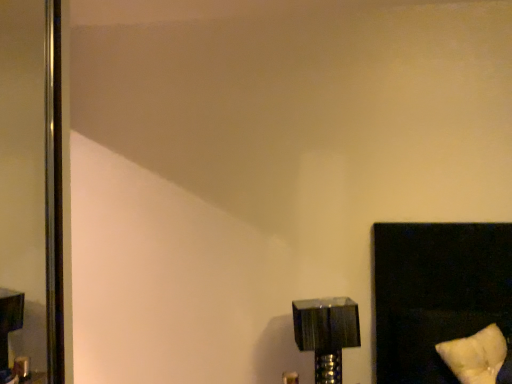
Image resolution: width=512 pixels, height=384 pixels. I want to click on white soft pillow at lower right, so point(475,355).

Which object is further away from the camera, polished metallic screen door at left or white soft pillow at lower right?

polished metallic screen door at left is more distant.

From a real-world perspective, which object stands above the other?

In real-world perspective, polished metallic screen door at left is above.

Is point (27, 68) more distant than point (476, 367)?

Yes, it is.

Which object is wider, polished metallic screen door at left or white soft pillow at lower right?

Wider between the two is white soft pillow at lower right.

Can polished metallic screen door at left be found inside white soft pillow at lower right?

That's incorrect, polished metallic screen door at left is not inside white soft pillow at lower right.

Between white soft pillow at lower right and polished metallic screen door at left, which one appears on the right side from the viewer's perspective?

Positioned to the right is white soft pillow at lower right.

Is point (492, 364) behind point (7, 261)?

No.

Is white soft pillow at lower right bigger than polished metallic screen door at left?

Actually, white soft pillow at lower right might be smaller than polished metallic screen door at left.

Can you confirm if metallic silver lamp at lower right is positioned to the right of polished metallic screen door at left?

Indeed, metallic silver lamp at lower right is positioned on the right side of polished metallic screen door at left.

From the image's perspective, who appears lower, metallic silver lamp at lower right or polished metallic screen door at left?

metallic silver lamp at lower right appears lower in the image.

Is metallic silver lamp at lower right oriented towards polished metallic screen door at left?

No, metallic silver lamp at lower right is not oriented towards polished metallic screen door at left.

Is metallic silver lamp at lower right with polished metallic screen door at left?

metallic silver lamp at lower right is not next to polished metallic screen door at left, and they're not touching.

Which of these two, metallic silver lamp at lower right or white soft pillow at lower right, is thinner?

metallic silver lamp at lower right.

Is point (340, 312) closer to camera compared to point (498, 334)?

No, it is not.

From a real-world perspective, which object stands above the other?

From a 3D spatial view, white soft pillow at lower right is above.

Who is shorter, polished metallic screen door at left or metallic silver lamp at lower right?

Standing shorter between the two is metallic silver lamp at lower right.

Considering the positions of point (38, 155) and point (346, 338), is point (38, 155) closer or farther from the camera than point (346, 338)?

Clearly, point (38, 155) is more distant from the camera than point (346, 338).

Is polished metallic screen door at left beside metallic silver lamp at lower right?

No.

From a real-world perspective, is white soft pillow at lower right under metallic silver lamp at lower right?

Actually, white soft pillow at lower right is physically above metallic silver lamp at lower right in the real world.

Which is further, (458, 354) or (333, 357)?

The point (333, 357) is behind.

Is white soft pillow at lower right surrounding metallic silver lamp at lower right?

No, metallic silver lamp at lower right is located outside of white soft pillow at lower right.

Is white soft pillow at lower right shorter than metallic silver lamp at lower right?

Yes.

The height and width of the screenshot is (384, 512). I want to click on pillow that appears on the right of polished metallic screen door at left, so click(x=475, y=355).

What are the coordinates of `pillow below the polished metallic screen door at left (from the image's perspective)` in the screenshot? It's located at (475, 355).

From the image, which object appears to be farther from white soft pillow at lower right, metallic silver lamp at lower right or polished metallic screen door at left?

Among the two, polished metallic screen door at left is located further to white soft pillow at lower right.

When comparing their distances from polished metallic screen door at left, does metallic silver lamp at lower right or white soft pillow at lower right seem further?

white soft pillow at lower right is positioned further to the anchor polished metallic screen door at left.

Looking at the image, which one is located further to metallic silver lamp at lower right, polished metallic screen door at left or white soft pillow at lower right?

polished metallic screen door at left is positioned further to the anchor metallic silver lamp at lower right.

From the image, which object appears to be nearer to white soft pillow at lower right, polished metallic screen door at left or metallic silver lamp at lower right?

metallic silver lamp at lower right lies closer to white soft pillow at lower right than the other object.

Considering their positions, is white soft pillow at lower right positioned further to metallic silver lamp at lower right than polished metallic screen door at left?

polished metallic screen door at left is positioned further to the anchor metallic silver lamp at lower right.

Which object lies further to the anchor point polished metallic screen door at left, white soft pillow at lower right or metallic silver lamp at lower right?

The object further to polished metallic screen door at left is white soft pillow at lower right.

Identify the location of lamp located between polished metallic screen door at left and white soft pillow at lower right in the left-right direction. The width and height of the screenshot is (512, 384). (326, 333).